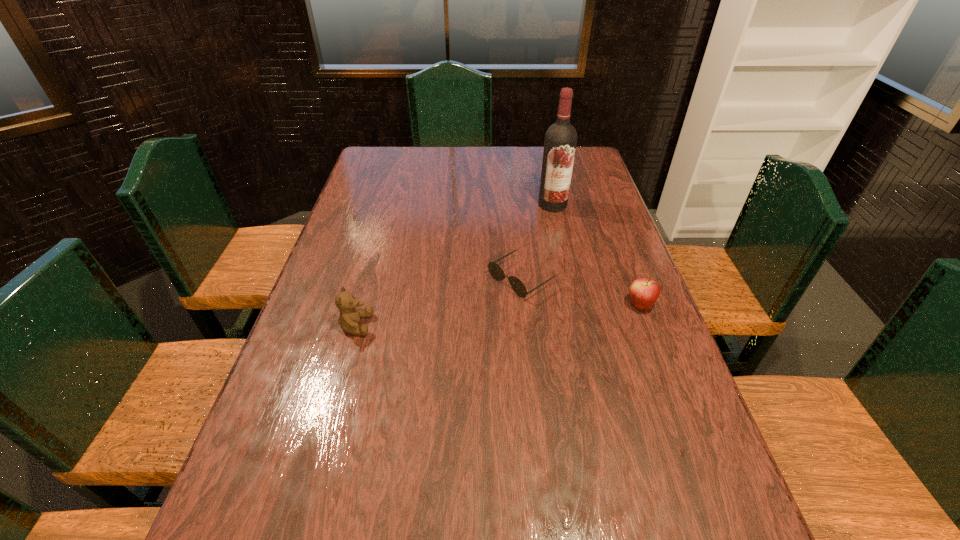
Where is `object that is the third closest one to the wine bottle`? object that is the third closest one to the wine bottle is located at coordinates (349, 318).

Find the location of a particular element. The width and height of the screenshot is (960, 540). the second closest object relative to the sunglasses is located at coordinates (560, 142).

Identify the location of vacant space that satisfies the following two spatial constraints: 1. on the front side of the farthest object; 2. on the right side of the rightmost object. The width and height of the screenshot is (960, 540). (575, 305).

Where is `free spot that satisfies the following two spatial constraints: 1. on the back side of the sunglasses; 2. on the left side of the tallest object`? free spot that satisfies the following two spatial constraints: 1. on the back side of the sunglasses; 2. on the left side of the tallest object is located at coordinates (514, 205).